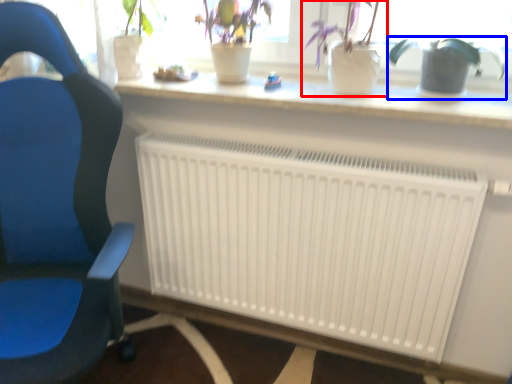
Question: Which of the following is the farthest to the observer, houseplant (highlighted by a red box) or houseplant (highlighted by a blue box)?

Choices:
 (A) houseplant
 (B) houseplant

Answer: (B)